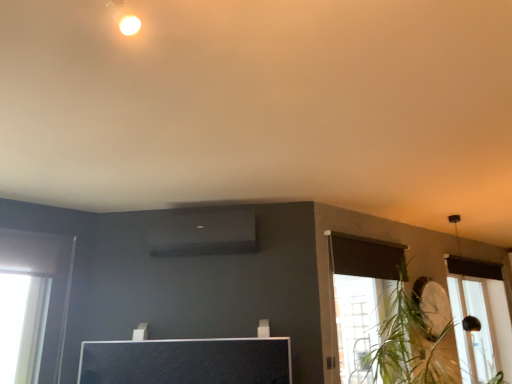
Question: From a real-world perspective, does green leafy plant at right sit lower than transparent glass window at lower right?

Choices:
 (A) yes
 (B) no

Answer: (B)

Question: Is transparent glass window at lower right inside green leafy plant at right?

Choices:
 (A) no
 (B) yes

Answer: (A)

Question: Is green leafy plant at right oriented away from transparent glass window at lower right?

Choices:
 (A) no
 (B) yes

Answer: (A)

Question: Does green leafy plant at right have a greater width compared to transparent glass window at lower right?

Choices:
 (A) yes
 (B) no

Answer: (A)

Question: From a real-world perspective, does green leafy plant at right stand above transparent glass window at lower right?

Choices:
 (A) yes
 (B) no

Answer: (A)

Question: Is green leafy plant at right further to camera compared to transparent glass window at lower right?

Choices:
 (A) no
 (B) yes

Answer: (A)

Question: Is transparent glass window at lower right placed right next to green leafy plant at right?

Choices:
 (A) no
 (B) yes

Answer: (A)

Question: From a real-world perspective, is transparent glass window at lower right physically above green leafy plant at right?

Choices:
 (A) yes
 (B) no

Answer: (B)

Question: Does transparent glass window at lower right contain green leafy plant at right?

Choices:
 (A) no
 (B) yes

Answer: (A)

Question: From the image's perspective, is transparent glass window at lower right located beneath green leafy plant at right?

Choices:
 (A) no
 (B) yes

Answer: (B)

Question: Considering the relative positions of transparent glass window at lower right and green leafy plant at right in the image provided, is transparent glass window at lower right to the right of green leafy plant at right from the viewer's perspective?

Choices:
 (A) no
 (B) yes

Answer: (B)

Question: Is transparent glass window at lower right far away from green leafy plant at right?

Choices:
 (A) no
 (B) yes

Answer: (A)

Question: Based on their sizes in the image, would you say green leafy plant at right is bigger or smaller than transparent glass window at lower right?

Choices:
 (A) big
 (B) small

Answer: (A)